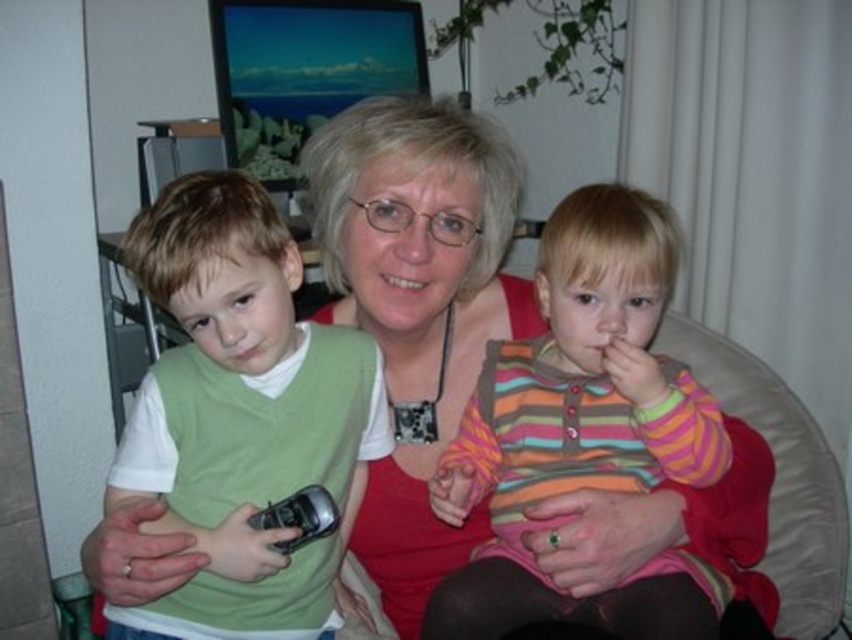
Question: Which of the following is the closest to the observer?

Choices:
 (A) (186, 314)
 (B) (540, 460)

Answer: (A)

Question: Which point is closer to the camera?

Choices:
 (A) (325, 604)
 (B) (469, 612)

Answer: (B)

Question: Can you confirm if striped cotton shirt at center is wider than green matte vest at left?

Choices:
 (A) yes
 (B) no

Answer: (A)

Question: In this image, where is striped cotton shirt at center located relative to green matte vest at left?

Choices:
 (A) above
 (B) below

Answer: (A)

Question: Can you confirm if striped cotton shirt at center is wider than green matte vest at left?

Choices:
 (A) no
 (B) yes

Answer: (B)